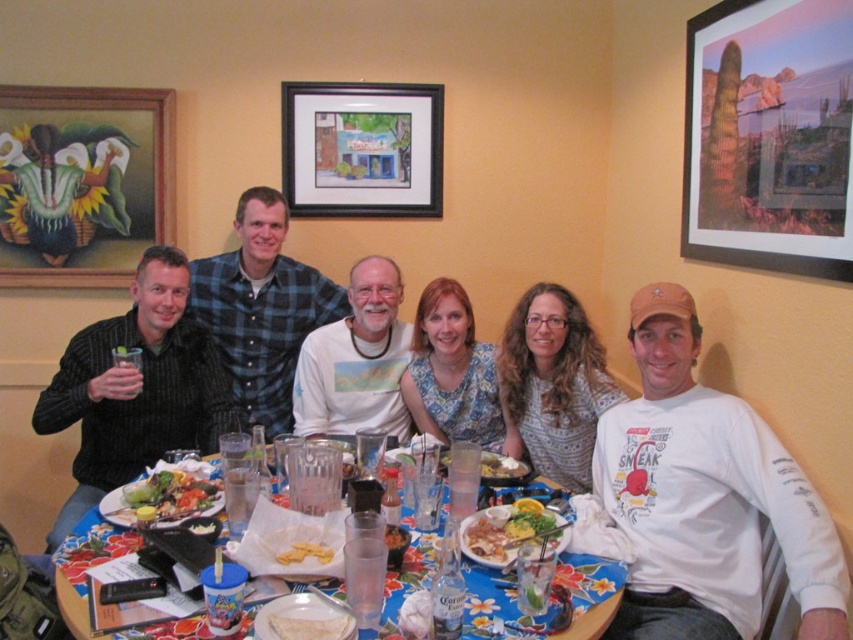
Can you confirm if fresh green salad at center is wider than shiny plastic plate at center?

Yes, fresh green salad at center is wider than shiny plastic plate at center.

Is point (207, 488) closer to camera compared to point (489, 525)?

No, (207, 488) is behind (489, 525).

Where is `fresh green salad at center`? fresh green salad at center is located at coordinates (166, 496).

Is point (787, 97) positioned before point (294, 380)?

Yes.

I want to click on metallic cactus at upper right, so click(769, 136).

Which is below, black striped shirt at left or floral fabric dress at center?

black striped shirt at left is lower down.

Who is positioned more to the left, black striped shirt at left or floral fabric dress at center?

From the viewer's perspective, black striped shirt at left appears more on the left side.

Does point (206, 406) come behind point (456, 292)?

Yes, it is behind point (456, 292).

Identify the location of black striped shirt at left. This screenshot has height=640, width=853. (136, 388).